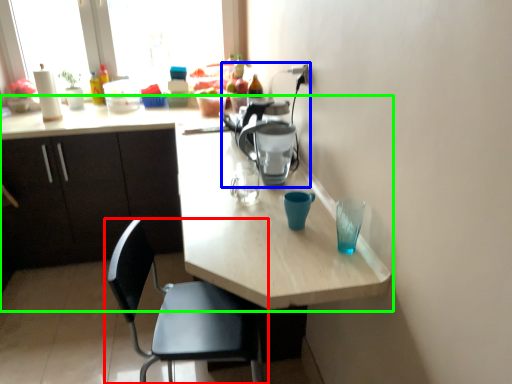
Question: Which object is the farthest from chair (highlighted by a red box)? Choose among these: coffeepot (highlighted by a blue box) or kitchen & dining room table (highlighted by a green box).

Choices:
 (A) coffeepot
 (B) kitchen & dining room table

Answer: (A)